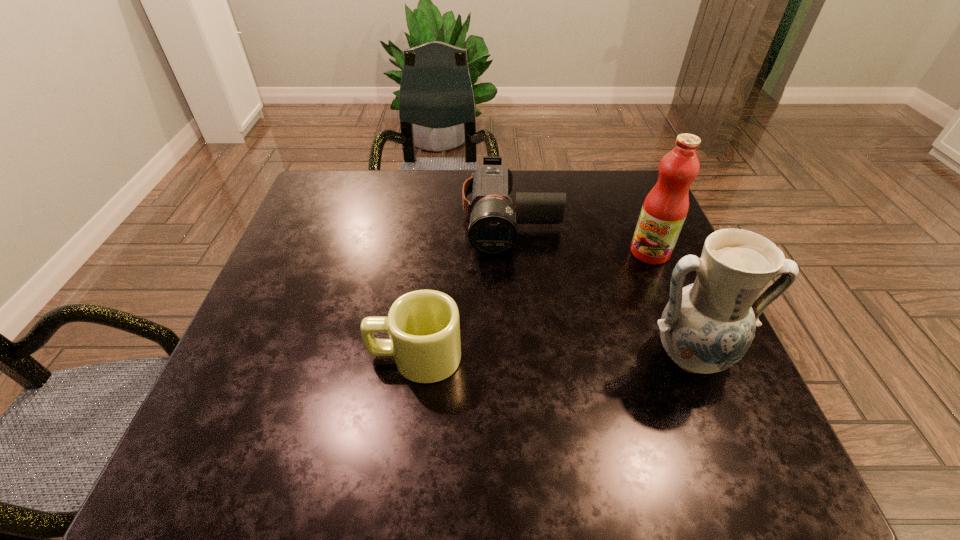
This screenshot has width=960, height=540. In order to click on free space located on the lens of the camcorder in this screenshot , I will do `click(513, 283)`.

Find the location of a particular element. vacant space located on the lens of the camcorder is located at coordinates 513,309.

Find the location of a particular element. The height and width of the screenshot is (540, 960). vacant region located on the lens of the camcorder is located at coordinates (514, 343).

You are a GUI agent. You are given a task and a screenshot of the screen. Output one action in this format:
    pyautogui.click(x=<x>, y=<y>)
    Task: Click on the object present at the far edge
    This screenshot has height=540, width=960.
    Given the screenshot: What is the action you would take?
    pyautogui.click(x=493, y=229)

What are the coordinates of `mug that is at the near edge` in the screenshot? It's located at (424, 328).

Identify the location of pottery positioned at the near edge. This screenshot has width=960, height=540. (706, 327).

This screenshot has width=960, height=540. Find the location of `pottery that is at the right edge`. pottery that is at the right edge is located at coordinates (706, 327).

Identify the location of fruit juice that is at the right edge. The width and height of the screenshot is (960, 540). (665, 208).

Where is `object situated at the near right corner`? The image size is (960, 540). object situated at the near right corner is located at coordinates (706, 327).

Image resolution: width=960 pixels, height=540 pixels. Find the location of `free space at the far edge of the desktop`. free space at the far edge of the desktop is located at coordinates (384, 191).